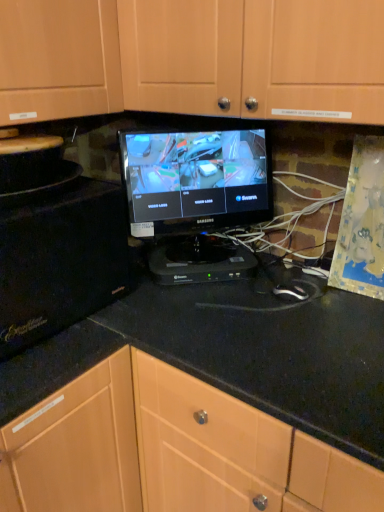
Question: Considering the relative sizes of black granite countertop at center and black glossy monitor at center in the image provided, is black granite countertop at center wider than black glossy monitor at center?

Choices:
 (A) yes
 (B) no

Answer: (A)

Question: Considering the relative sizes of black granite countertop at center and black glossy monitor at center in the image provided, is black granite countertop at center thinner than black glossy monitor at center?

Choices:
 (A) no
 (B) yes

Answer: (A)

Question: Can you see black granite countertop at center touching black glossy monitor at center?

Choices:
 (A) yes
 (B) no

Answer: (B)

Question: Is black granite countertop at center facing away from black glossy monitor at center?

Choices:
 (A) no
 (B) yes

Answer: (A)

Question: From the image's perspective, is black granite countertop at center located above black glossy monitor at center?

Choices:
 (A) yes
 (B) no

Answer: (B)

Question: From the image's perspective, relative to black plastic mouse at center, is black granite countertop at center above or below?

Choices:
 (A) below
 (B) above

Answer: (A)

Question: Is point (238, 312) positioned closer to the camera than point (291, 286)?

Choices:
 (A) farther
 (B) closer

Answer: (B)

Question: Do you think black granite countertop at center is within black plastic mouse at center, or outside of it?

Choices:
 (A) inside
 (B) outside

Answer: (B)

Question: Is black granite countertop at center taller or shorter than black plastic mouse at center?

Choices:
 (A) short
 (B) tall

Answer: (B)

Question: Is point (157, 218) positioned closer to the camera than point (18, 225)?

Choices:
 (A) farther
 (B) closer

Answer: (A)

Question: Is black glossy monitor at center bigger or smaller than black matte microwave at left, arranged as the second appliance when viewed from the right?

Choices:
 (A) big
 (B) small

Answer: (B)

Question: Relative to black matte microwave at left, arranged as the second appliance when viewed from the right, is black glossy monitor at center in front or behind?

Choices:
 (A) behind
 (B) front

Answer: (A)

Question: From the image's perspective, relative to black matte microwave at left, arranged as the second appliance when viewed from the right, is black glossy monitor at center above or below?

Choices:
 (A) below
 (B) above

Answer: (B)

Question: Do you think black plastic device at center, which is the first appliance in right-to-left order, is within black glossy monitor at center, or outside of it?

Choices:
 (A) outside
 (B) inside

Answer: (A)

Question: Based on their positions, is black plastic device at center, which is the first appliance in right-to-left order, located to the left or right of black glossy monitor at center?

Choices:
 (A) left
 (B) right

Answer: (B)